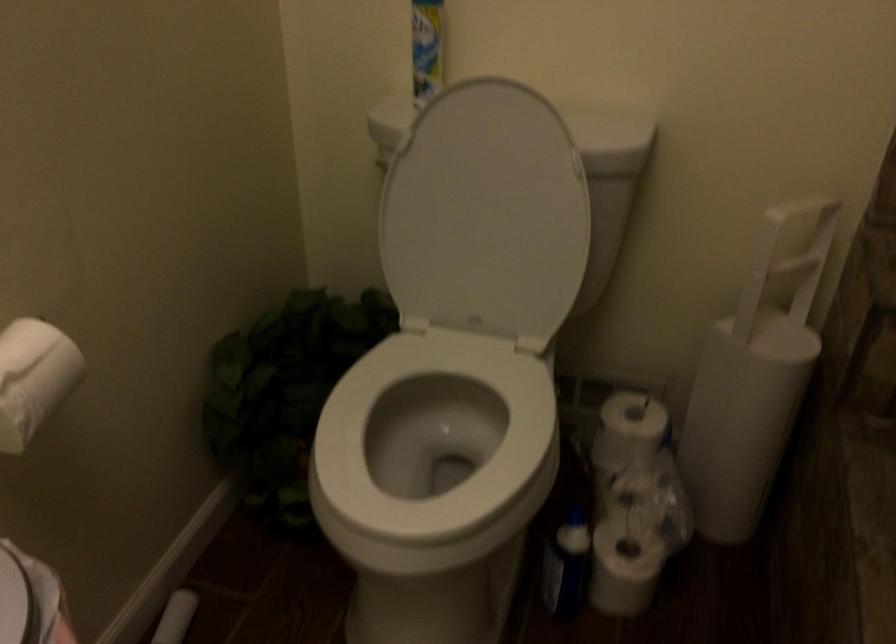
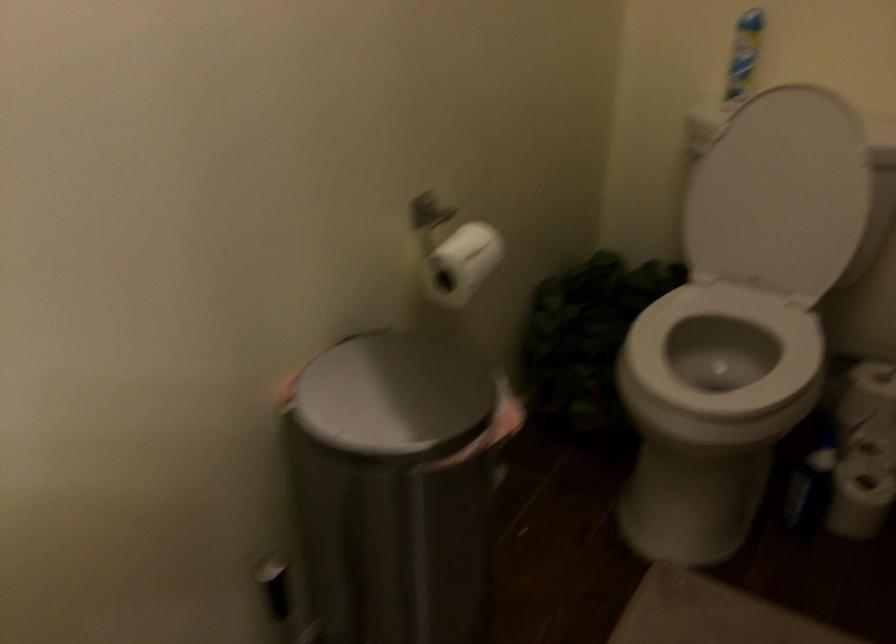
Question: The camera is either moving clockwise (left) or counter-clockwise (right) around the object. The first image is from the beginning of the video and the second image is from the end. Is the camera moving left or right when shooting the video?

Choices:
 (A) Left
 (B) Right

Answer: (B)